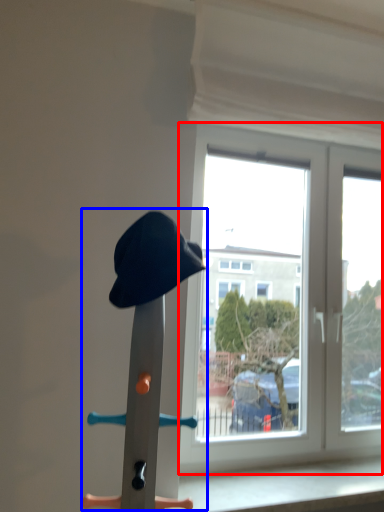
Question: Which of the following is the farthest to the observer, window (highlighted by a red box) or sculpture (highlighted by a blue box)?

Choices:
 (A) window
 (B) sculpture

Answer: (A)